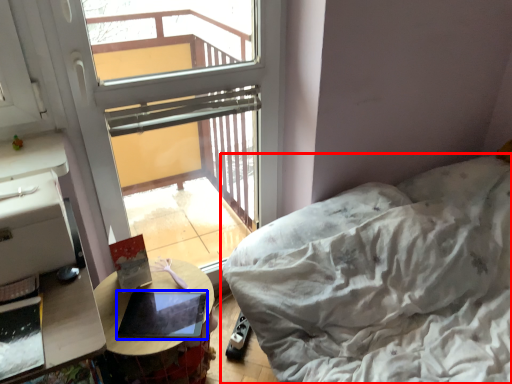
Question: Which point is further to the camera, furniture (highlighted by a red box) or laptop (highlighted by a blue box)?

Choices:
 (A) furniture
 (B) laptop

Answer: (B)